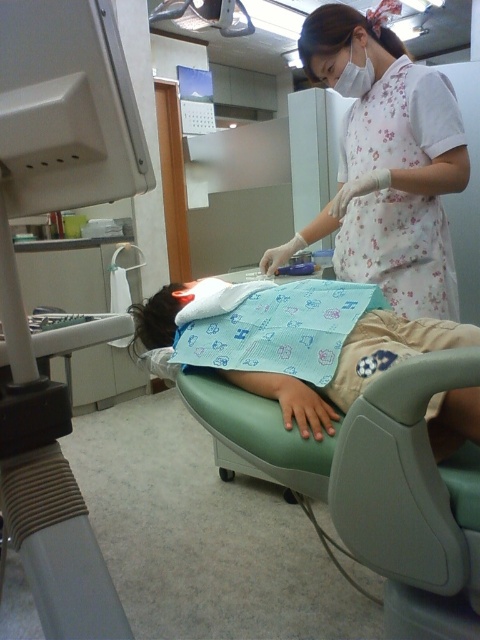
Who is more distant from viewer, [284,252] or [474,408]?

The point [284,252] is behind.

Which is more to the right, white floral uniform at upper right or blue fabric at center?

From the viewer's perspective, white floral uniform at upper right appears more on the right side.

At what (x,y) coordinates should I click in order to perform the action: click on white floral uniform at upper right. Please return your answer as a coordinate pair (x, y). Image resolution: width=480 pixels, height=640 pixels. Looking at the image, I should click on (385, 163).

The width and height of the screenshot is (480, 640). I want to click on white floral uniform at upper right, so 385,163.

Measure the distance between beige rubber dental chair at left and white floral uniform at upper right.

beige rubber dental chair at left is 37.11 inches away from white floral uniform at upper right.

Can you confirm if beige rubber dental chair at left is taller than white floral uniform at upper right?

No, beige rubber dental chair at left is not taller than white floral uniform at upper right.

Describe the element at coordinates (21, 292) in the screenshot. This screenshot has height=640, width=480. I see `beige rubber dental chair at left` at that location.

Identify the location of beige rubber dental chair at left. (21, 292).

Measure the distance from beige rubber dental chair at left to blue fabric at center.

The distance of beige rubber dental chair at left from blue fabric at center is 21.45 inches.

Consider the image. Can you confirm if beige rubber dental chair at left is positioned to the left of blue fabric at center?

Correct, you'll find beige rubber dental chair at left to the left of blue fabric at center.

Locate an element on the screen. Image resolution: width=480 pixels, height=640 pixels. beige rubber dental chair at left is located at coordinates (21, 292).

Find the location of a particular element. This screenshot has height=640, width=480. beige rubber dental chair at left is located at coordinates (21, 292).